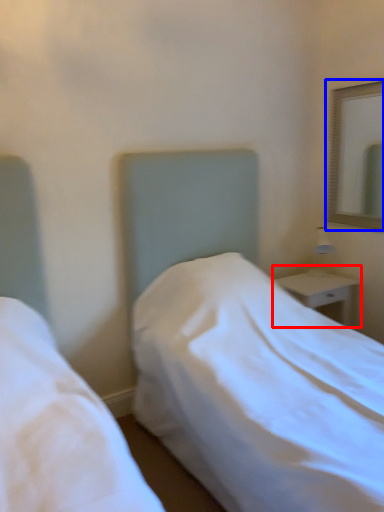
Question: Which point is closer to the camera, nightstand (highlighted by a red box) or mirror (highlighted by a blue box)?

Choices:
 (A) nightstand
 (B) mirror

Answer: (B)